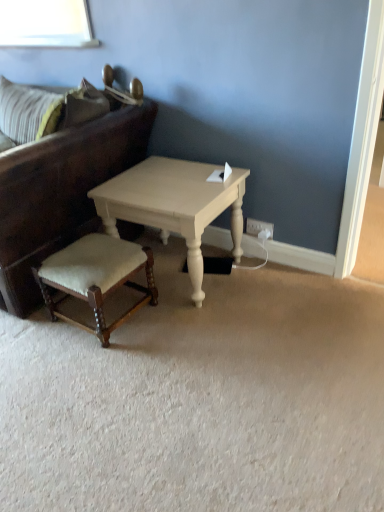
Where is `vacant region above white painted wood coffee table at center (from a real-world perspective)`? The width and height of the screenshot is (384, 512). vacant region above white painted wood coffee table at center (from a real-world perspective) is located at coordinates (163, 179).